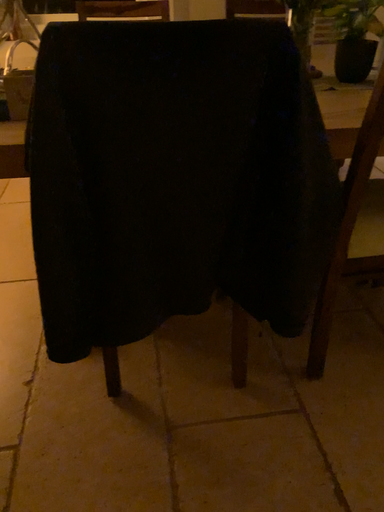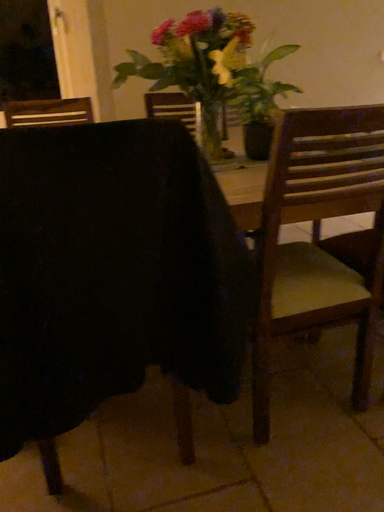
Question: Which way did the camera rotate in the video?

Choices:
 (A) rotated downward
 (B) rotated upward

Answer: (B)